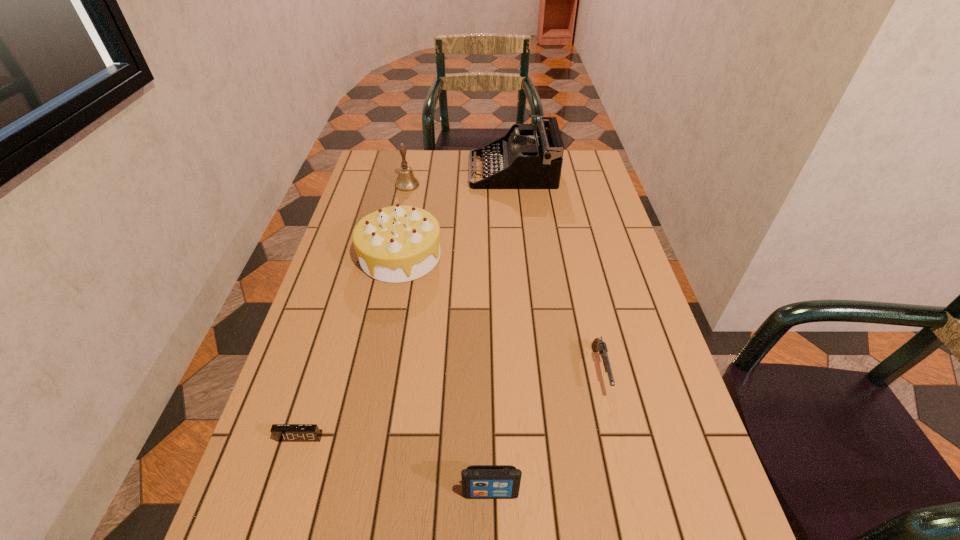
Locate an element on the screen. This screenshot has width=960, height=540. typewriter is located at coordinates (524, 158).

I want to click on bell, so click(x=406, y=181).

At what (x,y) coordinates should I click in order to perform the action: click on the fourth nearest object. Please return your answer as a coordinate pair (x, y). Looking at the image, I should click on (395, 244).

Identify the location of iPod. (478, 481).

At what (x,y) coordinates should I click in order to perform the action: click on the third shortest object. Please return your answer as a coordinate pair (x, y). This screenshot has height=540, width=960. Looking at the image, I should click on (478, 481).

I want to click on gun, so coord(598,344).

The image size is (960, 540). Identify the location of the third nearest object. (598, 344).

The height and width of the screenshot is (540, 960). Identify the location of the fifth farthest object. (282, 432).

This screenshot has width=960, height=540. Find the location of `alarm clock`. alarm clock is located at coordinates (282, 432).

You are a GUI agent. You are given a task and a screenshot of the screen. Output one action in this format:
    pyautogui.click(x=<x>, y=<y>)
    Task: Click on the vacant space located 0.050m on the typing side of the typewriter
    Image resolution: width=960 pixels, height=540 pixels.
    Given the screenshot: What is the action you would take?
    pyautogui.click(x=456, y=171)